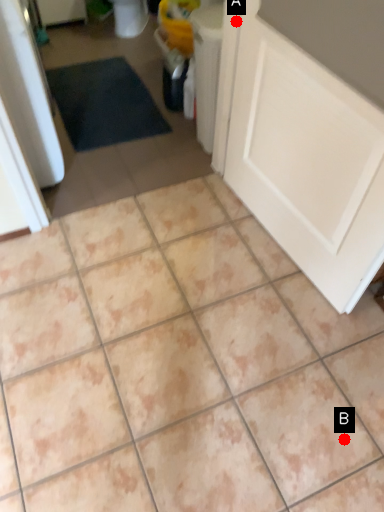
Question: Two points are circled on the image, labeled by A and B beside each circle. Which point is farther to the camera?

Choices:
 (A) A is further
 (B) B is further

Answer: (A)